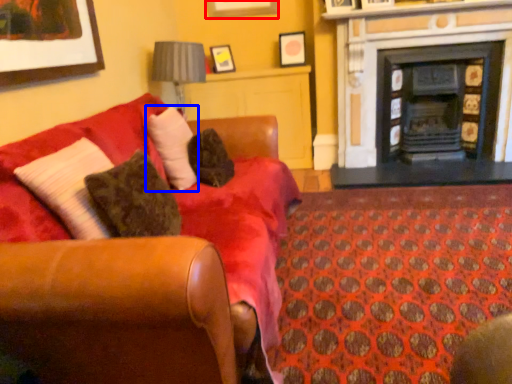
Question: Which of the following is the farthest to the observer, picture frame (highlighted by a red box) or pillow (highlighted by a blue box)?

Choices:
 (A) picture frame
 (B) pillow

Answer: (A)